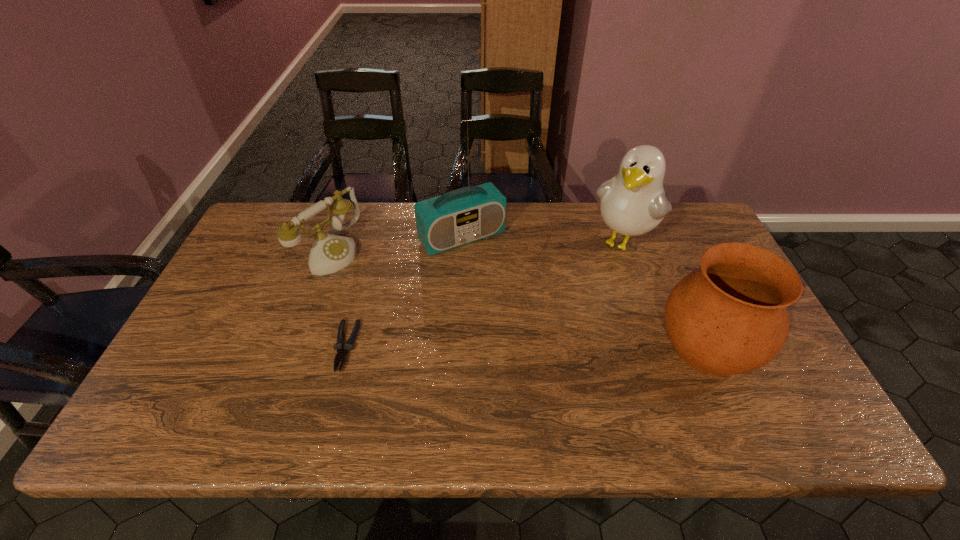
This screenshot has width=960, height=540. What are the coordinates of `free space between the leftmost object and the third object from left to right` in the screenshot? It's located at (396, 244).

Locate an element on the screen. vacant area between the gull and the fourth object from right to left is located at coordinates (485, 294).

The width and height of the screenshot is (960, 540). Identify the location of free spot between the third shortest object and the radio receiver. [x=585, y=292].

Where is `empty location between the third object from left to right and the telephone`? The image size is (960, 540). empty location between the third object from left to right and the telephone is located at coordinates (396, 244).

Identify the location of free point between the third shortest object and the fourth shortest object. This screenshot has width=960, height=540. (665, 294).

Identify the location of free spot between the pottery and the leftmost object. The height and width of the screenshot is (540, 960). (518, 299).

I want to click on unoccupied position between the second shortest object and the third object from left to right, so click(x=396, y=244).

Where is `free space between the fourth tallest object and the third tallest object`? This screenshot has height=540, width=960. free space between the fourth tallest object and the third tallest object is located at coordinates (518, 299).

In order to click on free spot between the pottery and the fourth shortest object in this screenshot , I will do `click(665, 294)`.

The width and height of the screenshot is (960, 540). I want to click on free space between the shortest object and the leftmost object, so click(338, 299).